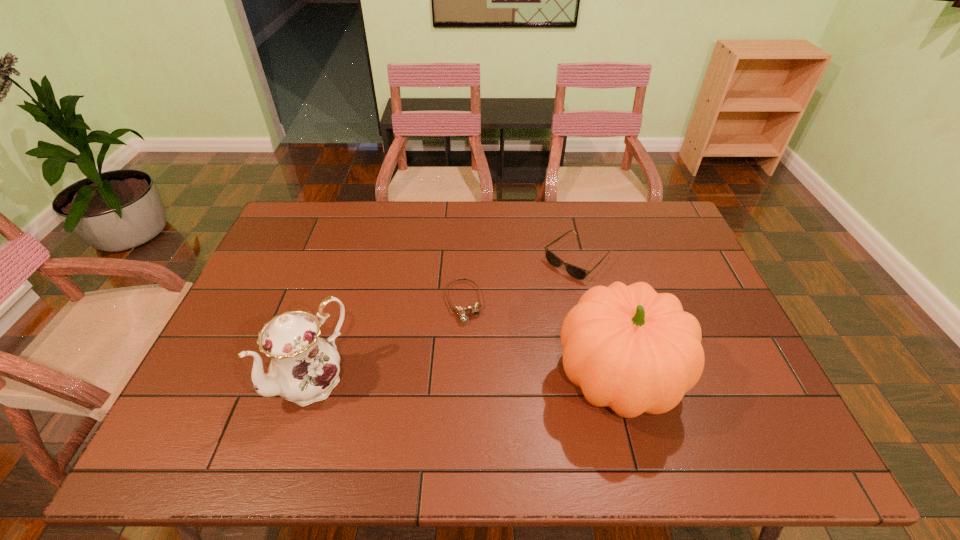
This screenshot has width=960, height=540. In order to click on free spot on the desktop that is between the chinaware and the pumpkin and is positioned on the front lenses and sides of the second object from left to right in this screenshot , I will do `click(486, 380)`.

Locate an element on the screen. The image size is (960, 540). free space on the desktop that is between the leftmost object and the pumpkin and is positioned on the lenses of the sunglasses is located at coordinates (x=436, y=380).